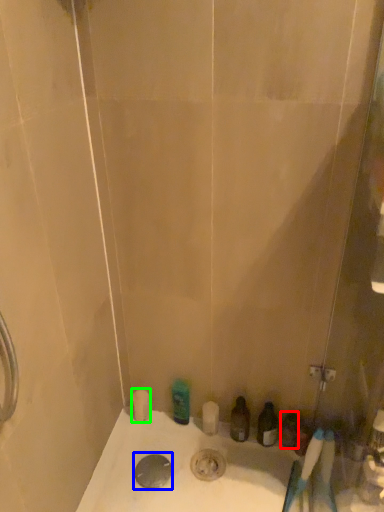
Question: Based on their relative distances, which object is farther from toiletry (highlighted by a red box)? Choose from drain (highlighted by a blue box) and toilet paper (highlighted by a green box).

Choices:
 (A) drain
 (B) toilet paper

Answer: (B)